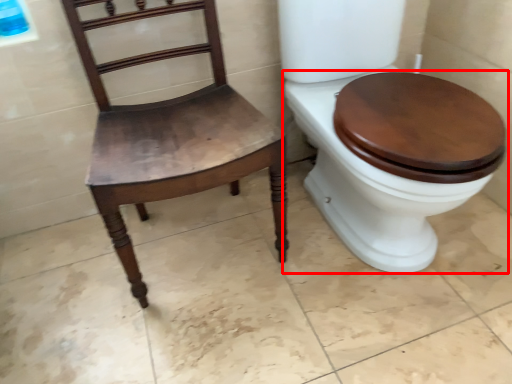
Question: From the image's perspective, considering the relative positions of toilet (annotated by the red box) and chair in the image provided, where is toilet (annotated by the red box) located with respect to the staircase?

Choices:
 (A) above
 (B) below

Answer: (A)